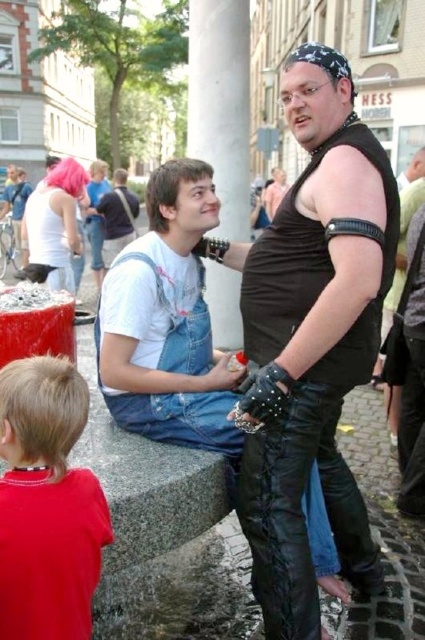
You are a photographer trying to capture a candid shot of the black leather pants at center and the red cotton shirt at lower left. Based on their positions, which one is higher up in the frame?

The black leather pants at center is above the red cotton shirt at lower left in the frame.

You are a photographer trying to capture both the denim overalls at center and the red cotton shirt at lower left in the same frame. Given that your camera has a focal length of 50mm and the minimum distance between subjects for clarity is 8 feet, will you be able to include both subjects in your photo without them overlapping too much?

The denim overalls at center and red cotton shirt at lower left are 10.36 feet apart from each other, which exceeds the minimum required distance of 8 feet. Therefore, you can capture both subjects in the same frame without overlapping too much.